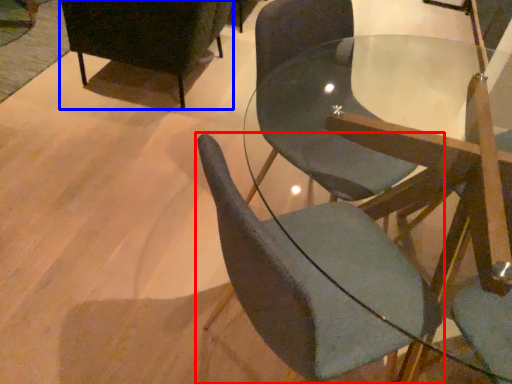
Question: Which object appears farthest to the camera in this image, chair (highlighted by a red box) or chair (highlighted by a blue box)?

Choices:
 (A) chair
 (B) chair

Answer: (B)